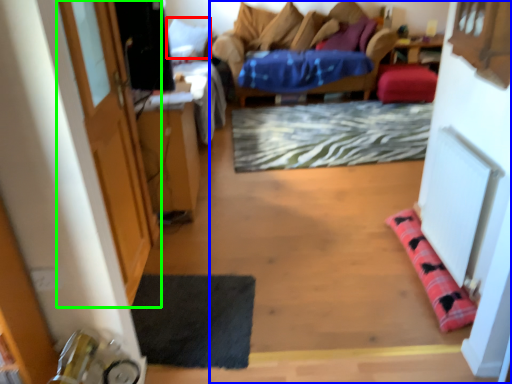
Question: Considering the real-world distances, which object is farthest from pillow (highlighted by a red box)? studio couch (highlighted by a blue box) or door (highlighted by a green box)?

Choices:
 (A) studio couch
 (B) door

Answer: (A)